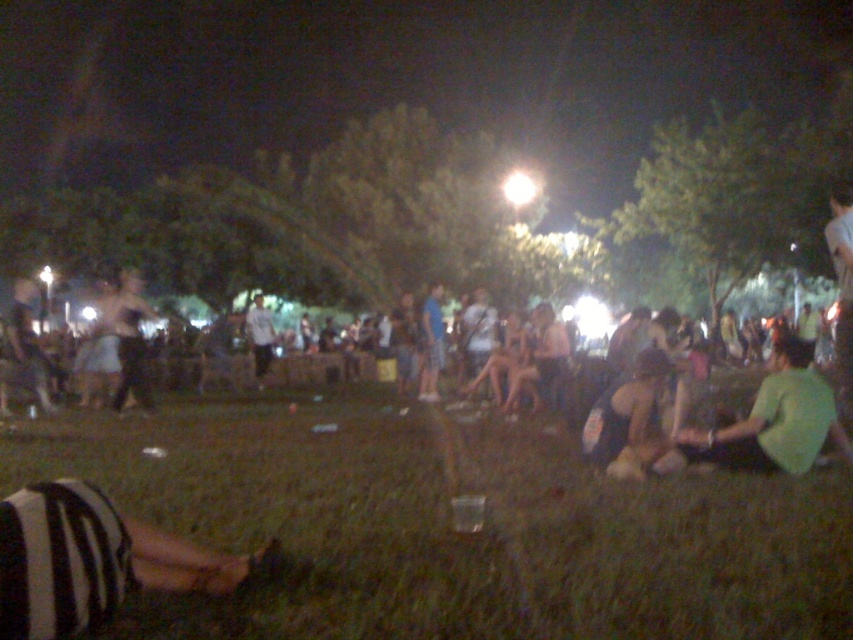
Question: Is dark green fabric at lower right thinner than dark gray striped shirt at left?

Choices:
 (A) yes
 (B) no

Answer: (A)

Question: Can you confirm if green grass at lower center is positioned below striped fabric leg at lower left?

Choices:
 (A) no
 (B) yes

Answer: (B)

Question: Can you confirm if striped fabric leg at lower left is positioned to the right of dark clothing crowd at center?

Choices:
 (A) yes
 (B) no

Answer: (B)

Question: Which point is farther to the camera?

Choices:
 (A) (554, 337)
 (B) (10, 584)
 (C) (15, 384)

Answer: (C)

Question: Which point is closer to the camera taking this photo?

Choices:
 (A) (167, 422)
 (B) (764, 444)
 (C) (51, 573)
 (D) (312, 378)

Answer: (C)

Question: Which of the following is the closest to the observer?

Choices:
 (A) (125, 554)
 (B) (741, 464)
 (C) (641, 403)

Answer: (A)